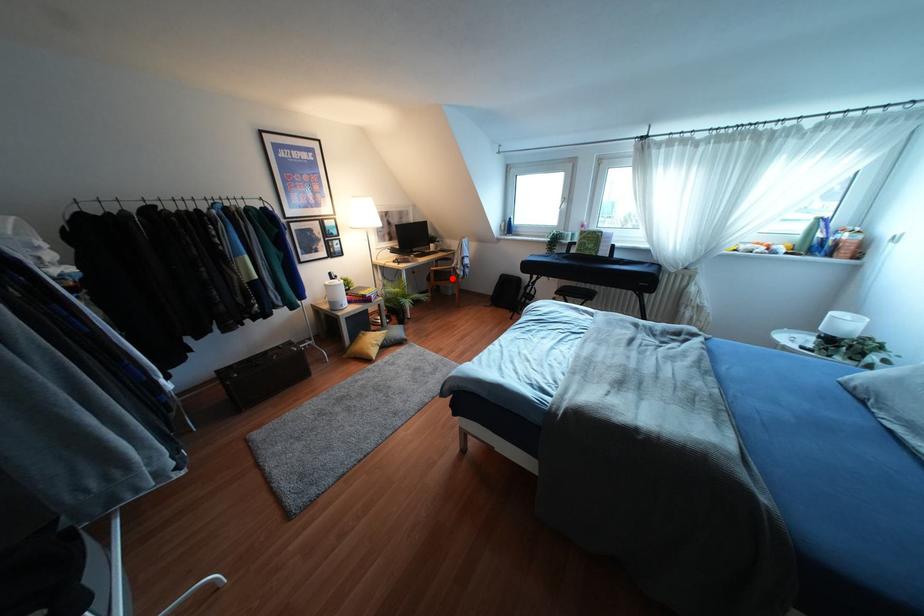
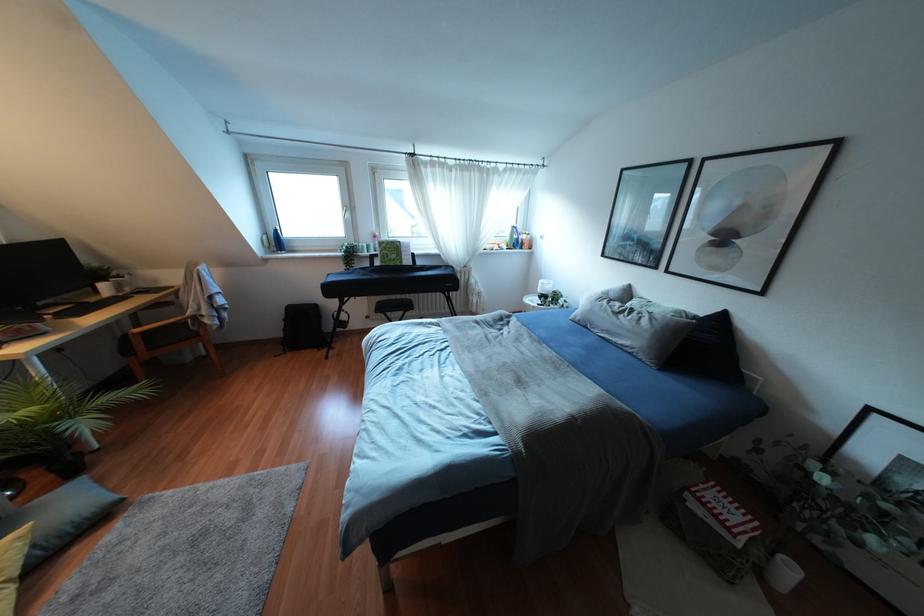
In the second image, find the point that corresponds to the highlighted location in the first image.

(196, 334)